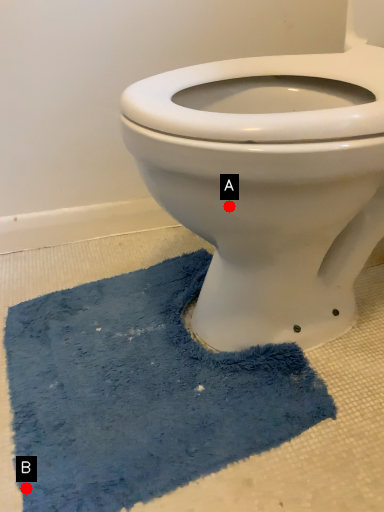
Question: Two points are circled on the image, labeled by A and B beside each circle. Which point is closer to the camera?

Choices:
 (A) A is closer
 (B) B is closer

Answer: (A)